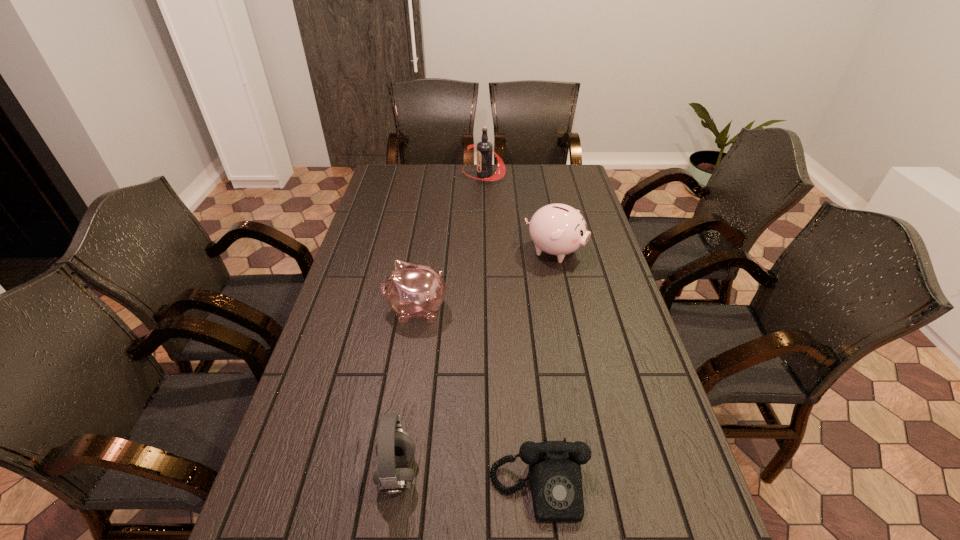
Where is `free space located on the label of the tallest object`? This screenshot has width=960, height=540. free space located on the label of the tallest object is located at coordinates (433, 174).

Locate an element on the screen. free space located on the back of the right piggy bank is located at coordinates (544, 202).

Identify the location of vacant space positioned on the ear cups of the headset. Image resolution: width=960 pixels, height=540 pixels. point(492,473).

Image resolution: width=960 pixels, height=540 pixels. I want to click on vacant area located on the front facing side of the nearer piggy bank, so click(x=359, y=310).

This screenshot has width=960, height=540. Identify the location of object situated at the far edge. coord(485,152).

Identify the location of object present at the left edge. pos(413,290).

Image resolution: width=960 pixels, height=540 pixels. In order to click on object that is at the right edge in this screenshot , I will do `click(557, 229)`.

I want to click on free space at the far edge, so click(453, 176).

Identify the location of free space at the left edge of the desktop. The height and width of the screenshot is (540, 960). (380, 247).

I want to click on vacant space at the right edge of the desktop, so click(x=594, y=244).